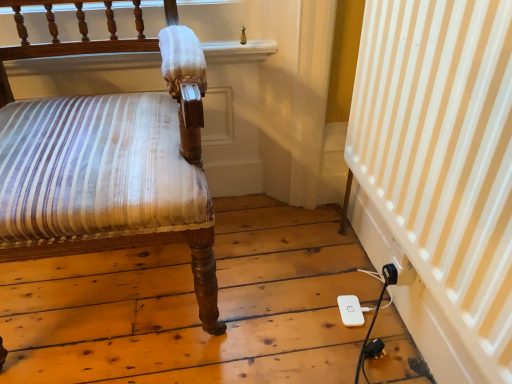
Find the location of a particular element. This screenshot has height=384, width=512. vacant space that is in between matte brown wood chair at left and white plastic ipod at lower right is located at coordinates (270, 274).